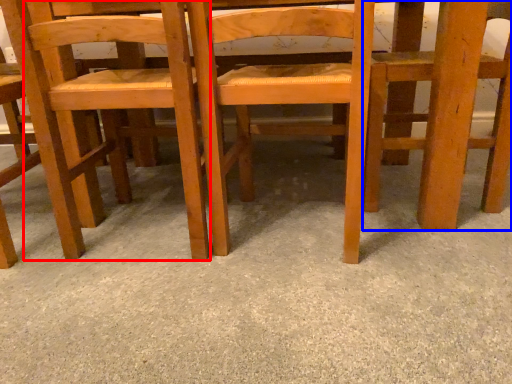
Question: Which object appears closest to the camera in this image, chair (highlighted by a red box) or chair (highlighted by a blue box)?

Choices:
 (A) chair
 (B) chair

Answer: (A)